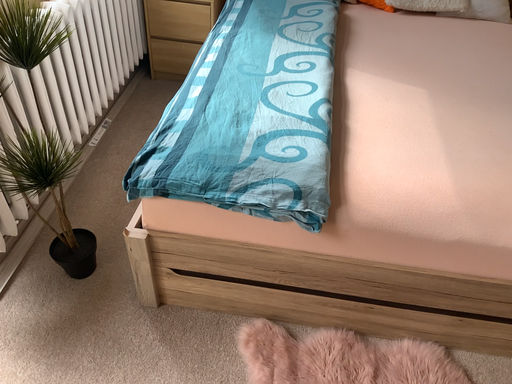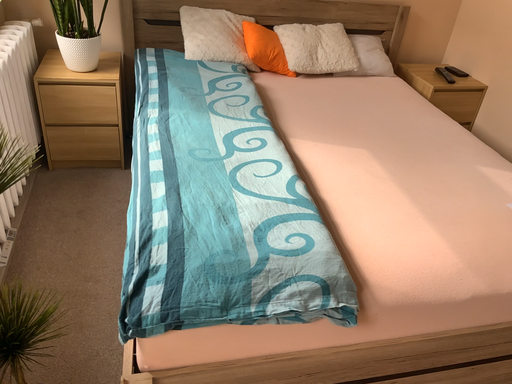
Question: How did the camera likely rotate when shooting the video?

Choices:
 (A) rotated left
 (B) rotated right

Answer: (B)